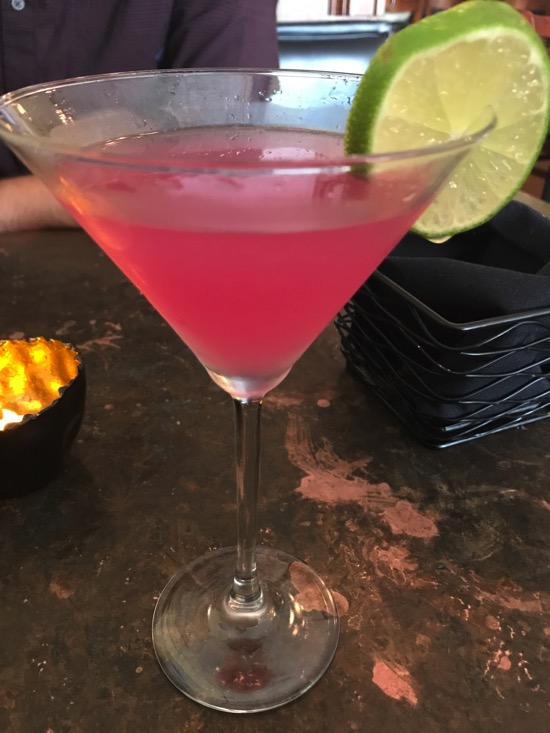
Where is `candleholder`? The height and width of the screenshot is (733, 550). candleholder is located at coordinates (58, 416), (37, 372).